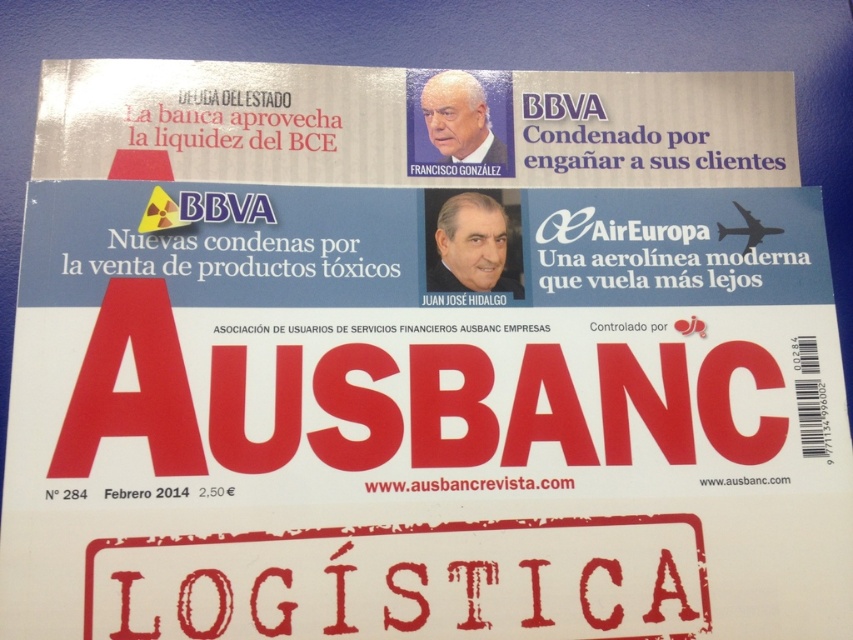
Question: Can you confirm if smooth skin portrait at center is positioned above white matte portrait at upper center?

Choices:
 (A) yes
 (B) no

Answer: (B)

Question: Can you confirm if smooth skin portrait at center is positioned above white matte portrait at upper center?

Choices:
 (A) yes
 (B) no

Answer: (B)

Question: Which point is farther to the camera?

Choices:
 (A) (451, 124)
 (B) (486, 200)

Answer: (A)

Question: Is smooth skin portrait at center smaller than white matte portrait at upper center?

Choices:
 (A) no
 (B) yes

Answer: (A)

Question: Which point is closer to the camera?

Choices:
 (A) (476, 204)
 (B) (476, 157)

Answer: (A)